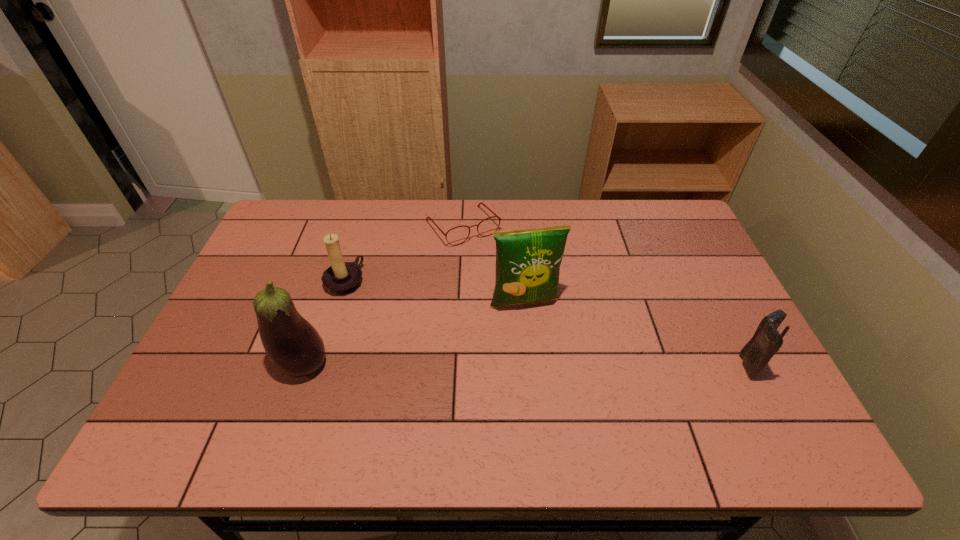
I want to click on vacant space located 0.120m on the face of the shortest object, so click(496, 270).

You are a GUI agent. You are given a task and a screenshot of the screen. Output one action in this format:
    pyautogui.click(x=<x>, y=<y>)
    Task: Click on the free space located on the face of the shortest object
    
    Given the screenshot: What is the action you would take?
    pyautogui.click(x=516, y=296)

Image resolution: width=960 pixels, height=540 pixels. In order to click on free space located 0.090m on the face of the shortest object in this screenshot , I will do `click(492, 264)`.

Find the location of a particular element. This screenshot has width=960, height=540. vacant space located 0.060m on the front-facing side of the crisp (potato chip) is located at coordinates (536, 332).

The width and height of the screenshot is (960, 540). I want to click on free space located 0.070m on the front-facing side of the crisp (potato chip), so click(x=537, y=335).

Locate an element on the screen. The image size is (960, 540). vacant area situated 0.170m on the front-facing side of the crisp (potato chip) is located at coordinates (546, 366).

The width and height of the screenshot is (960, 540). Identify the location of object located in the far edge section of the desktop. (478, 205).

Find the location of a particular element. The image size is (960, 540). eggplant at the near edge is located at coordinates (293, 345).

The width and height of the screenshot is (960, 540). Find the location of `cellular telephone present at the near edge`. cellular telephone present at the near edge is located at coordinates (766, 341).

Locate an element on the screen. The height and width of the screenshot is (540, 960). object located in the right edge section of the desktop is located at coordinates (766, 341).